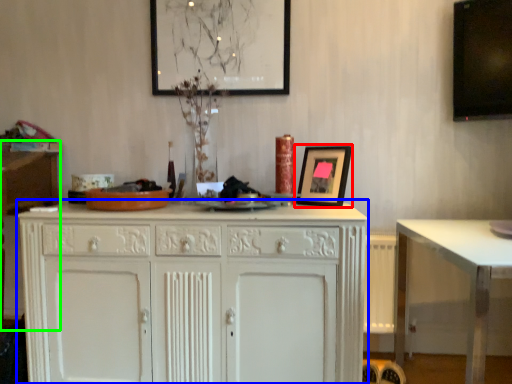
Question: Which object is the farthest from picture frame (highlighted by a red box)? Choose among these: cabinetry (highlighted by a blue box) or vanity (highlighted by a green box).

Choices:
 (A) cabinetry
 (B) vanity

Answer: (B)